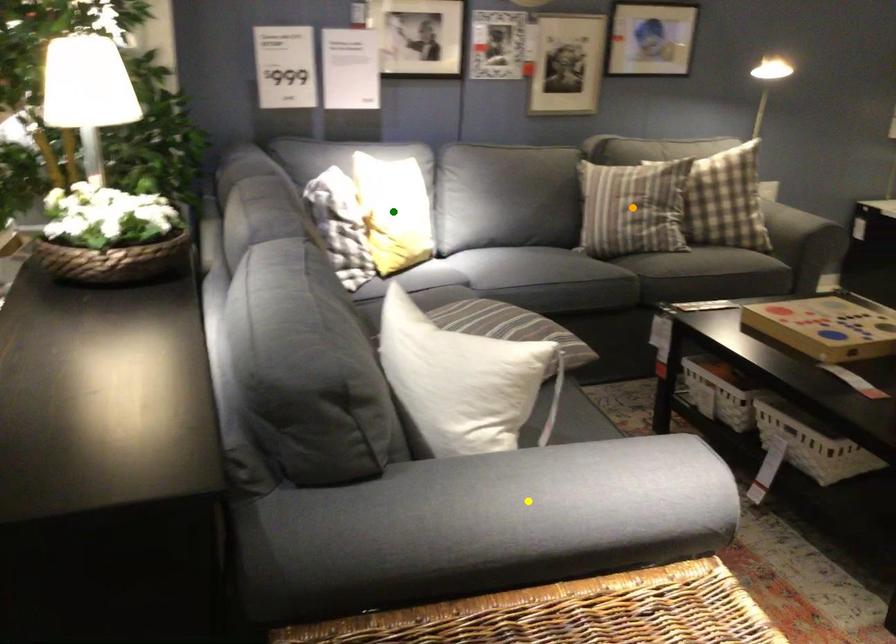
Order these from farthest to nearest:
yellow point | green point | orange point

orange point < green point < yellow point